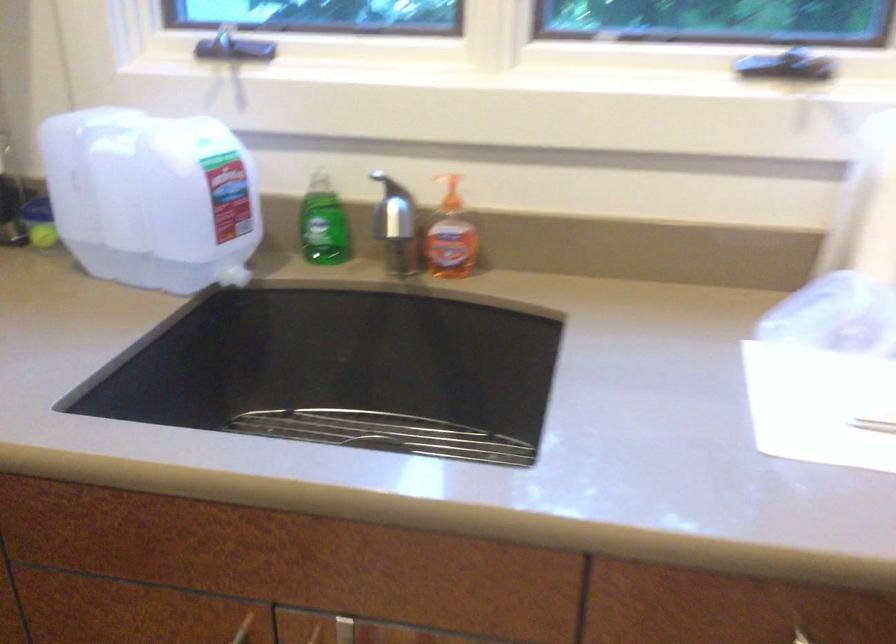
Find the location of a particular element. white jug handle is located at coordinates (220, 135).